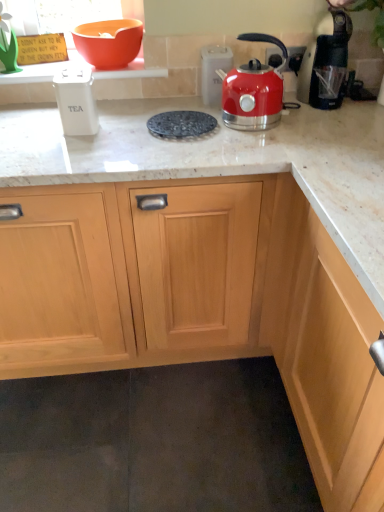
Image resolution: width=384 pixels, height=512 pixels. Identify the location of vacant space to the right of shiny metallic kettle at upper right, the third kitchen appliance viewed from the left. (306, 125).